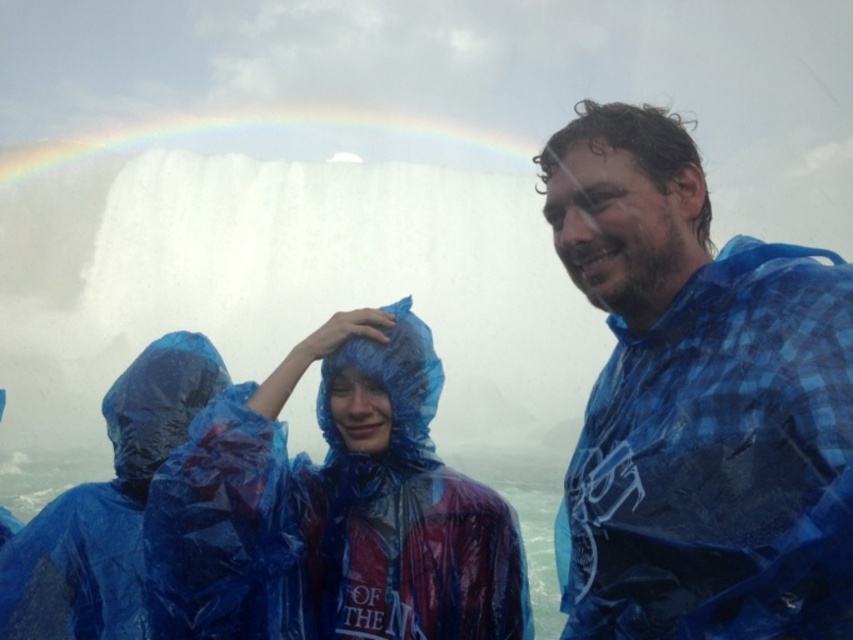
Question: Which object appears farthest from the camera in this image?

Choices:
 (A) transparent plastic raincoat at center
 (B) blue plastic poncho at lower left
 (C) rainbow at upper center

Answer: (C)

Question: Among these objects, which one is nearest to the camera?

Choices:
 (A) transparent plastic raincoat at center
 (B) rainbow at upper center
 (C) blue plastic poncho at lower left
 (D) blue plaid shirt at center

Answer: (D)

Question: Is blue plastic poncho at lower left positioned behind rainbow at upper center?

Choices:
 (A) no
 (B) yes

Answer: (A)

Question: Which point is closer to the camera?

Choices:
 (A) blue plaid shirt at center
 (B) transparent plastic raincoat at center
 (C) blue plastic poncho at lower left

Answer: (A)

Question: Where is blue plaid shirt at center located in relation to blue plastic poncho at lower left in the image?

Choices:
 (A) below
 (B) above

Answer: (B)

Question: Does blue plaid shirt at center have a smaller size compared to transparent plastic raincoat at center?

Choices:
 (A) no
 (B) yes

Answer: (A)